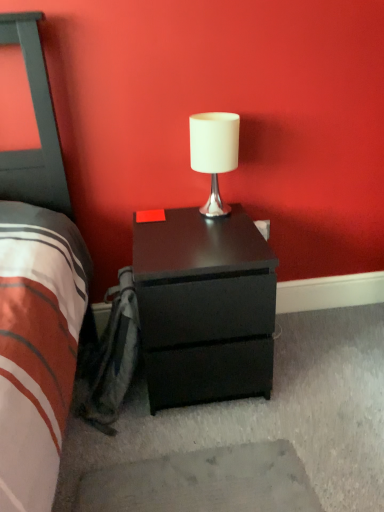
You are a GUI agent. You are given a task and a screenshot of the screen. Output one action in this format:
    pyautogui.click(x=<x>, y=<y>)
    Task: Click on the vacant space to the right of matte black nightstand at center
    The height and width of the screenshot is (512, 384).
    Given the screenshot: What is the action you would take?
    pyautogui.click(x=320, y=365)